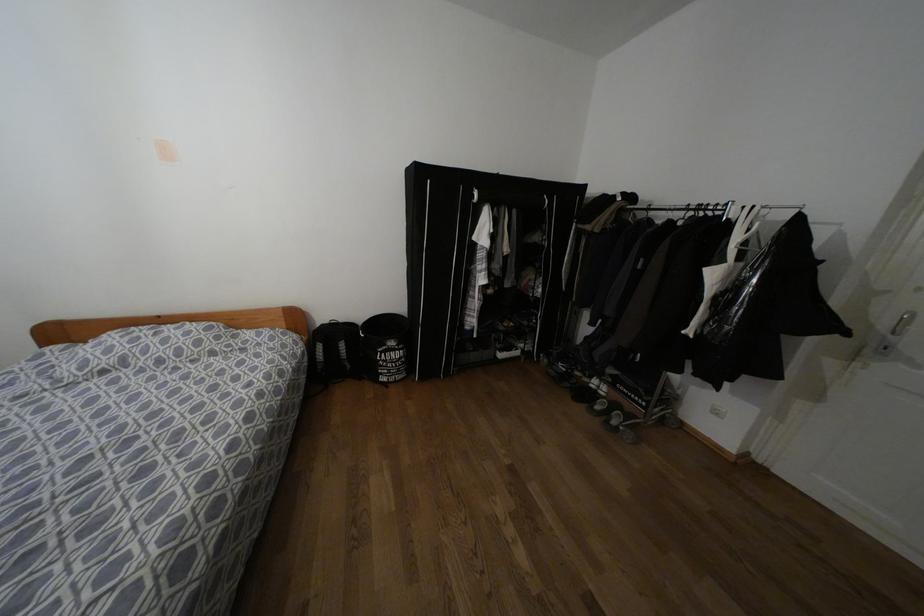
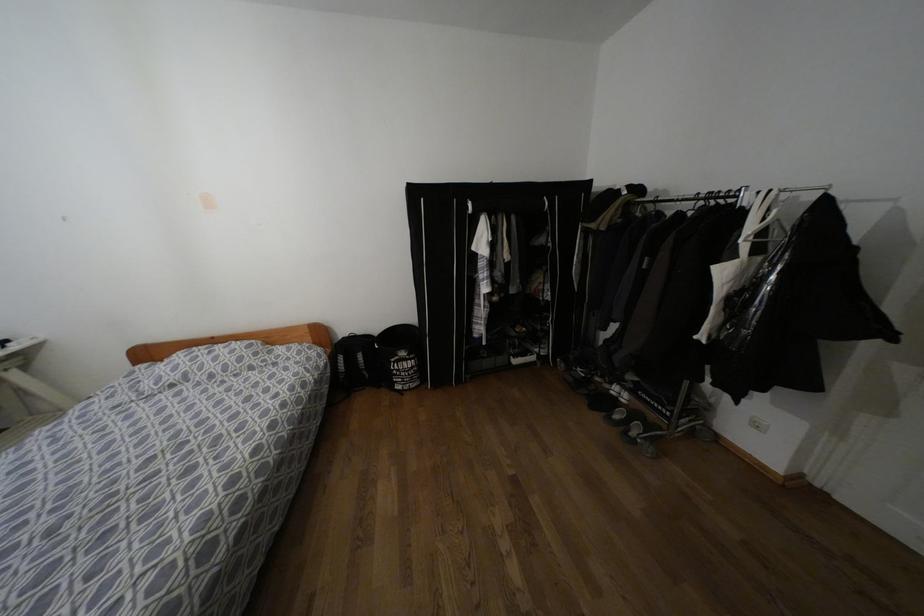
Question: Based on the continuous images, in which direction is the camera rotating? Reply with the corresponding letter.

Choices:
 (A) Left
 (B) Right
 (C) Up
 (D) Down

Answer: (A)